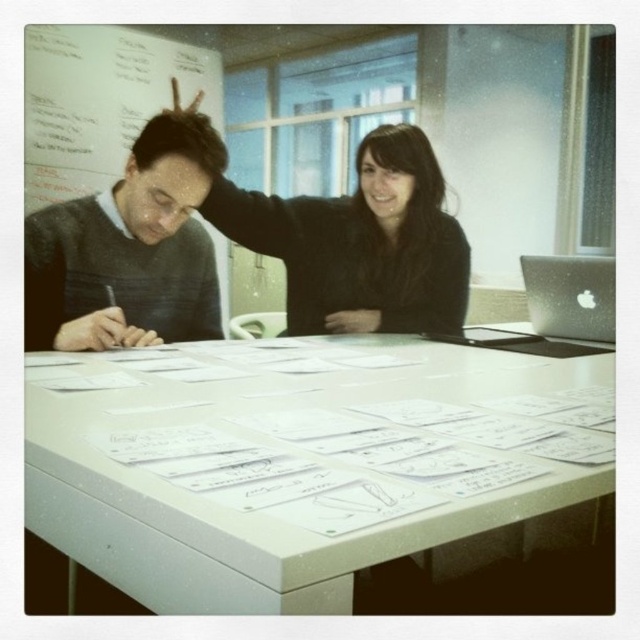
Is white matte paperboard at upper left below silver metallic laptop at upper right?

No, white matte paperboard at upper left is not below silver metallic laptop at upper right.

Between white matte paperboard at upper left and silver metallic laptop at upper right, which one has more height?

white matte paperboard at upper left

You are a GUI agent. You are given a task and a screenshot of the screen. Output one action in this format:
    pyautogui.click(x=<x>, y=<y>)
    Task: Click on the white matte paperboard at upper left
    This screenshot has width=640, height=640.
    Given the screenshot: What is the action you would take?
    pyautogui.click(x=99, y=100)

Where is `white matte paperboard at upper left`? This screenshot has width=640, height=640. white matte paperboard at upper left is located at coordinates tap(99, 100).

Is black matte sweater at upper center above white matte paperboard at upper left?

Actually, black matte sweater at upper center is below white matte paperboard at upper left.

Does point (436, 259) come in front of point (97, 44)?

Yes, it is.

Image resolution: width=640 pixels, height=640 pixels. Find the location of `black matte sweater at upper center`. black matte sweater at upper center is located at coordinates (360, 243).

Is black matte sweater at upper center to the right of silver metallic laptop at upper right from the viewer's perspective?

In fact, black matte sweater at upper center is to the left of silver metallic laptop at upper right.

Is black matte sweater at upper center thinner than silver metallic laptop at upper right?

In fact, black matte sweater at upper center might be wider than silver metallic laptop at upper right.

Identify the location of black matte sweater at upper center. (360, 243).

Identify the location of black matte sweater at upper center. (360, 243).